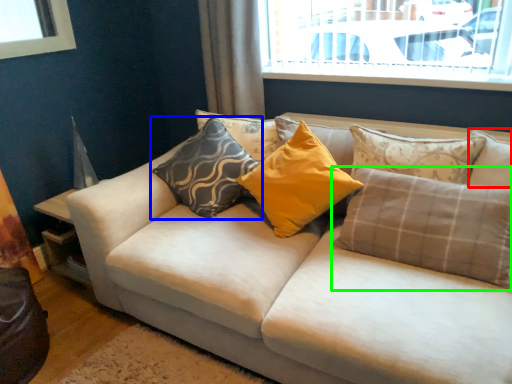
Question: Which is farther away from pillow (highlighted by a red box)? pillow (highlighted by a blue box) or pillow (highlighted by a green box)?

Choices:
 (A) pillow
 (B) pillow

Answer: (A)